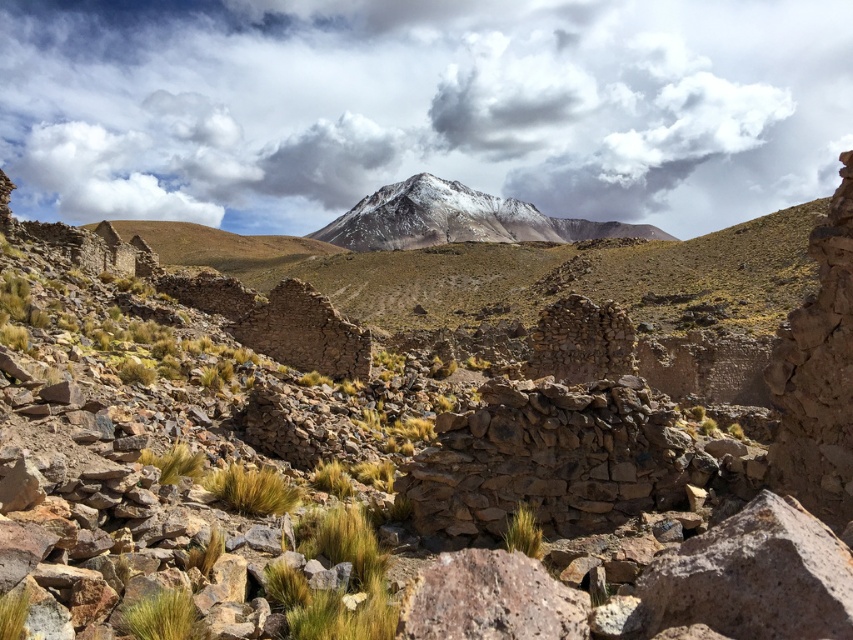
Is brown stone ruins at center to the left of snowy rocky mountain at center from the viewer's perspective?

Indeed, brown stone ruins at center is positioned on the left side of snowy rocky mountain at center.

The height and width of the screenshot is (640, 853). Describe the element at coordinates (154, 422) in the screenshot. I see `brown stone ruins at center` at that location.

This screenshot has width=853, height=640. Identify the location of brown stone ruins at center. point(154,422).

Does brown stone ruins at center appear on the right side of green grass at lower left?

Yes, brown stone ruins at center is to the right of green grass at lower left.

Which is more to the left, brown stone ruins at center or green grass at lower left?

From the viewer's perspective, green grass at lower left appears more on the left side.

Identify the location of brown stone ruins at center. The image size is (853, 640). (154, 422).

Between snowy rocky mountain at center and golden grass at center, which one is positioned higher?

Positioned higher is snowy rocky mountain at center.

I want to click on snowy rocky mountain at center, so click(x=457, y=220).

The image size is (853, 640). I want to click on snowy rocky mountain at center, so click(x=457, y=220).